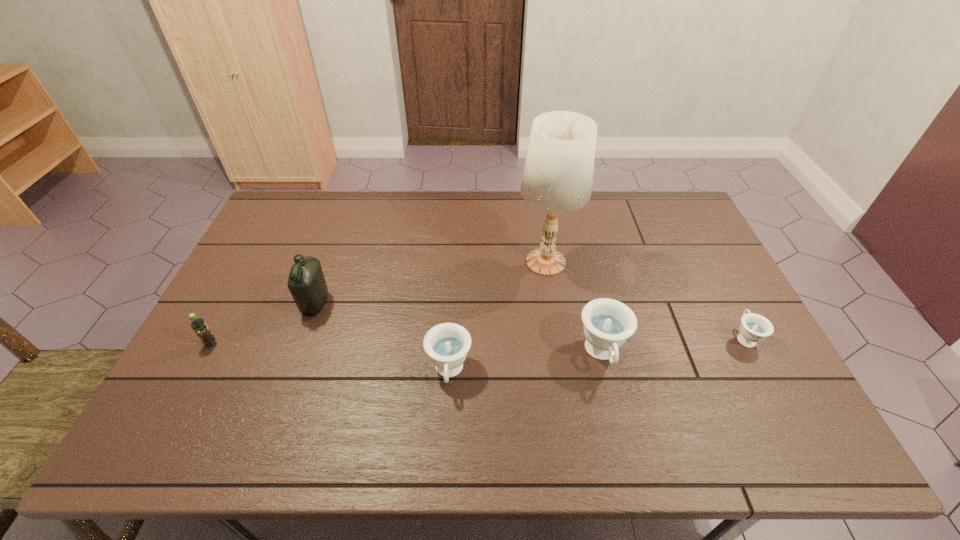
This screenshot has height=540, width=960. Find the location of `the leftmost teacup`. the leftmost teacup is located at coordinates (447, 344).

At what (x,y) coordinates should I click in order to perform the action: click on the fourth object from right to left. Please return your answer as a coordinate pair (x, y). Looking at the image, I should click on (447, 344).

The width and height of the screenshot is (960, 540). I want to click on the second teacup from right to left, so click(608, 323).

Locate an element on the screen. the rightmost object is located at coordinates (754, 328).

This screenshot has height=540, width=960. I want to click on the rightmost teacup, so click(x=754, y=328).

I want to click on the fifth nearest object, so click(x=306, y=282).

The height and width of the screenshot is (540, 960). I want to click on the second tallest object, so (306, 282).

At what (x,y) coordinates should I click in order to perform the action: click on lamp. Please return your answer as a coordinate pair (x, y). The height and width of the screenshot is (540, 960). Looking at the image, I should click on (558, 174).

At what (x,y) coordinates should I click in order to perform the action: click on the farthest object. Please return your answer as a coordinate pair (x, y). Looking at the image, I should click on coord(558,174).

Identify the location of soda. 198,324.